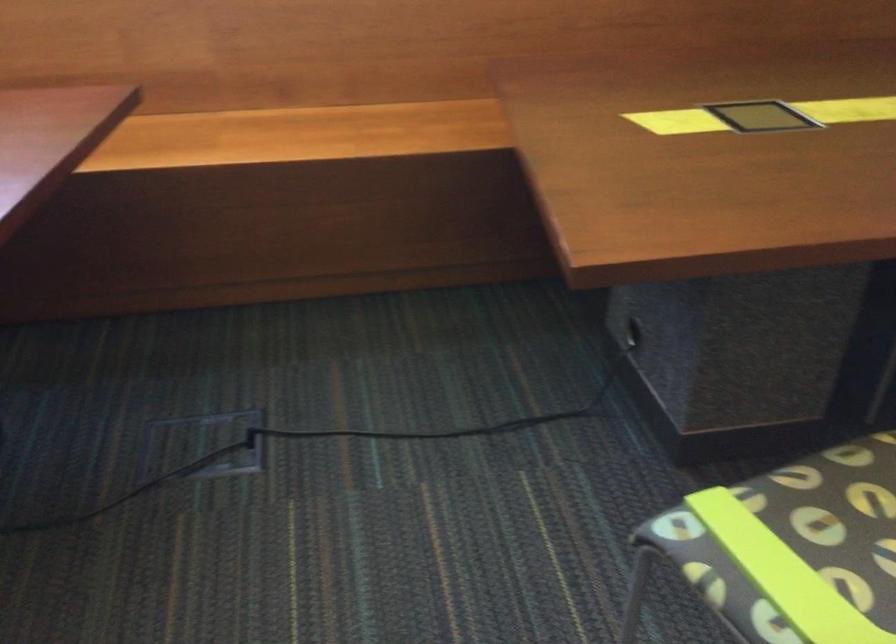
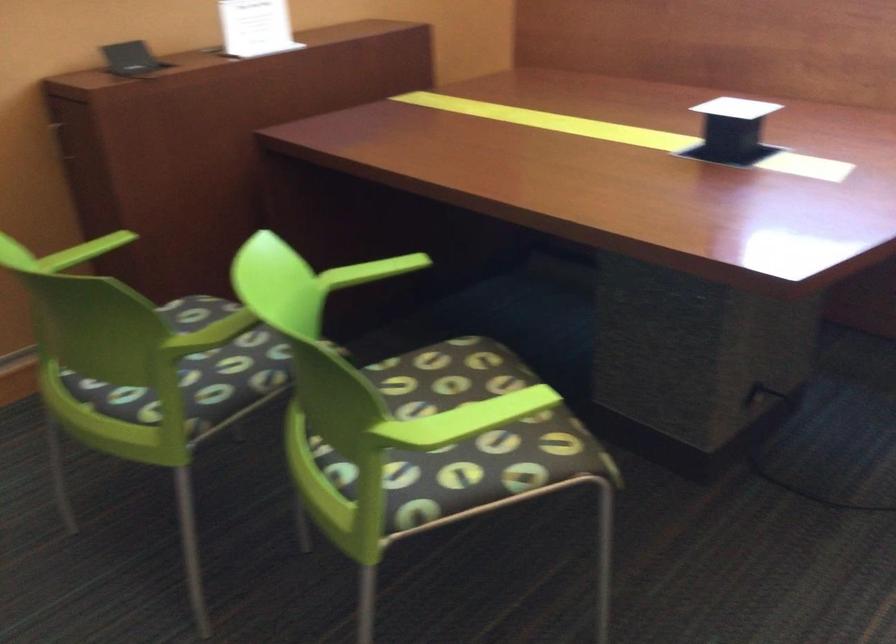
Question: The camera is either moving clockwise (left) or counter-clockwise (right) around the object. The first image is from the beginning of the video and the second image is from the end. Is the camera moving left or right when shooting the video?

Choices:
 (A) Left
 (B) Right

Answer: (B)